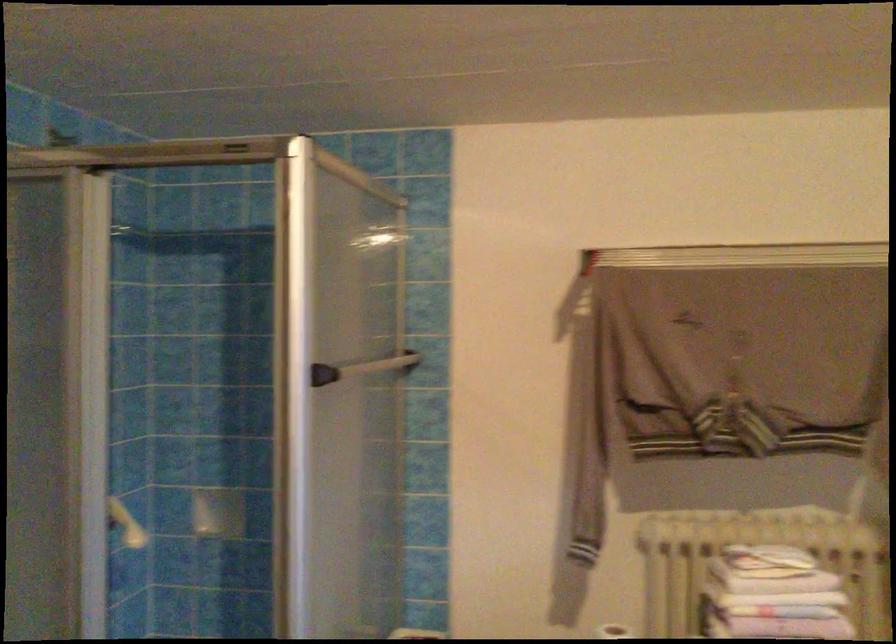
I want to click on shower door handle, so point(125,524).